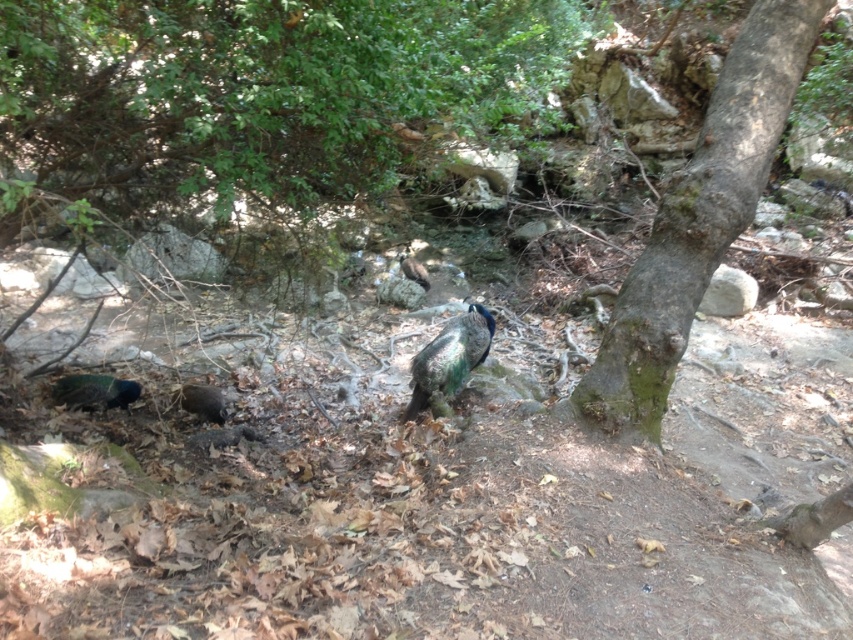
Question: Which point is closer to the camera?

Choices:
 (A) (82, 401)
 (B) (485, 340)

Answer: (B)

Question: Observing the image, what is the correct spatial positioning of green mossy bark tree at center right in reference to green iridescent peacock at lower left?

Choices:
 (A) left
 (B) right

Answer: (B)

Question: Which point appears farthest from the camera in this image?

Choices:
 (A) (106, 408)
 (B) (651, 364)
 (C) (405, 253)

Answer: (C)

Question: Is shiny green peacock at center to the left of green iridescent peacock at center from the viewer's perspective?

Choices:
 (A) no
 (B) yes

Answer: (A)

Question: Is shiny green peacock at center thinner than green iridescent peacock at center?

Choices:
 (A) yes
 (B) no

Answer: (B)

Question: Which point is closer to the camera?

Choices:
 (A) (99, 380)
 (B) (473, 353)
 (C) (712, 211)

Answer: (C)